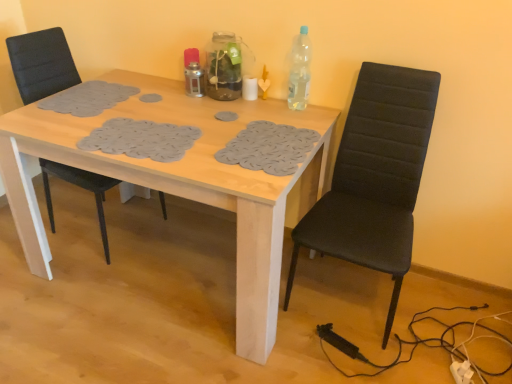
Question: Does clear plastic bottle at upper right come in front of black fabric chair at right, the 2th chair viewed from the left?

Choices:
 (A) yes
 (B) no

Answer: (B)

Question: Considering the relative sizes of clear plastic bottle at upper right and black fabric chair at right, the 2th chair viewed from the left, in the image provided, is clear plastic bottle at upper right smaller than black fabric chair at right, the 2th chair viewed from the left,?

Choices:
 (A) yes
 (B) no

Answer: (A)

Question: Is clear plastic bottle at upper right not close to black fabric chair at right, the 2th chair viewed from the left?

Choices:
 (A) yes
 (B) no

Answer: (B)

Question: Is clear plastic bottle at upper right at the left side of black fabric chair at right, the 2th chair viewed from the left?

Choices:
 (A) no
 (B) yes

Answer: (B)

Question: From the image's perspective, would you say clear plastic bottle at upper right is shown under black fabric chair at right, the 2th chair viewed from the left?

Choices:
 (A) no
 (B) yes

Answer: (A)

Question: Based on their sizes in the image, would you say black fabric chair at right, the 2th chair viewed from the left, is bigger or smaller than clear plastic bottle at upper right?

Choices:
 (A) small
 (B) big

Answer: (B)

Question: Is black fabric chair at right, the 2th chair viewed from the left, wider or thinner than clear plastic bottle at upper right?

Choices:
 (A) wide
 (B) thin

Answer: (A)

Question: From a real-world perspective, is black fabric chair at right, the 2th chair viewed from the left, above or below clear plastic bottle at upper right?

Choices:
 (A) below
 (B) above

Answer: (A)

Question: Is black fabric chair at right, the 2th chair viewed from the left, taller or shorter than clear plastic bottle at upper right?

Choices:
 (A) tall
 (B) short

Answer: (A)

Question: Would you say black fabric chair at right, the 2th chair viewed from the left, is inside or outside black fabric chair at left, the 1th chair positioned from the left?

Choices:
 (A) outside
 (B) inside

Answer: (A)

Question: Considering the positions of black fabric chair at right, the first chair from the right, and black fabric chair at left, placed as the 2th chair when sorted from right to left, in the image, is black fabric chair at right, the first chair from the right, wider or thinner than black fabric chair at left, placed as the 2th chair when sorted from right to left,?

Choices:
 (A) wide
 (B) thin

Answer: (A)

Question: From the image's perspective, relative to black fabric chair at left, placed as the 2th chair when sorted from right to left, is black fabric chair at right, the first chair from the right, above or below?

Choices:
 (A) below
 (B) above

Answer: (A)

Question: Would you say black fabric chair at right, the first chair from the right, is to the left or to the right of black fabric chair at left, the 1th chair positioned from the left, in the picture?

Choices:
 (A) left
 (B) right

Answer: (B)

Question: Considering the positions of clear plastic bottle at upper right and black fabric chair at left, placed as the 2th chair when sorted from right to left, in the image, is clear plastic bottle at upper right taller or shorter than black fabric chair at left, placed as the 2th chair when sorted from right to left,?

Choices:
 (A) tall
 (B) short

Answer: (B)

Question: In the image, is clear plastic bottle at upper right on the left side or the right side of black fabric chair at left, placed as the 2th chair when sorted from right to left?

Choices:
 (A) right
 (B) left

Answer: (A)